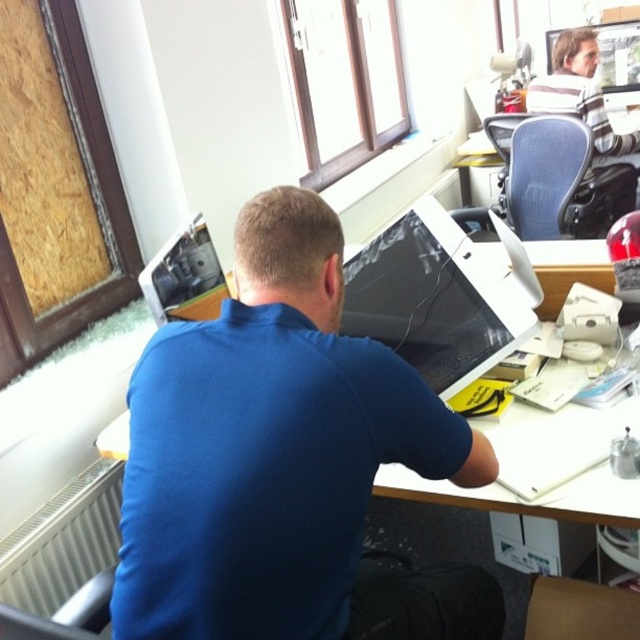
You are a delivery person entering the office and need to hand a package to the person wearing the blue matte shirt at center. The package is too large to place on the desk. Where should you stand to ensure they can see you clearly while avoiding blocking the matte black monitor at center?

Since the blue matte shirt at center is closer to the viewer than the matte black monitor at center, you should stand to the side of the desk where the blue matte shirt at center is positioned. This allows the person to see you without obstructing the monitor.